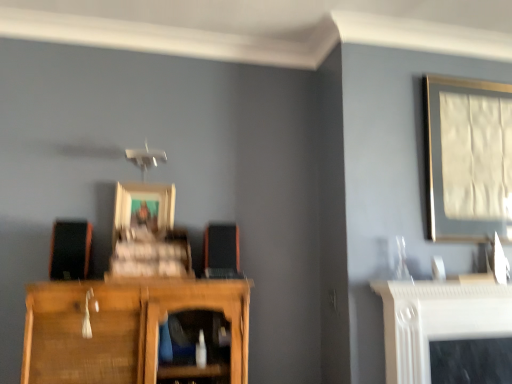
Question: Is matte black speaker at left, the second speaker in the right-to-left sequence, at the right side of wooden picture frame at center, which ranks as the 2th picture frame in right-to-left order?

Choices:
 (A) yes
 (B) no

Answer: (B)

Question: From a real-world perspective, is matte black speaker at left, the second speaker in the right-to-left sequence, physically below wooden picture frame at center, which ranks as the 2th picture frame in right-to-left order?

Choices:
 (A) no
 (B) yes

Answer: (B)

Question: From a real-world perspective, is matte black speaker at left, the second speaker in the right-to-left sequence, on wooden picture frame at center, placed as the first picture frame when sorted from left to right?

Choices:
 (A) yes
 (B) no

Answer: (B)

Question: Does matte black speaker at left, acting as the first speaker starting from the left, come in front of wooden picture frame at center, placed as the first picture frame when sorted from left to right?

Choices:
 (A) yes
 (B) no

Answer: (A)

Question: Is matte black speaker at left, the second speaker in the right-to-left sequence, facing away from wooden picture frame at center, which ranks as the 2th picture frame in right-to-left order?

Choices:
 (A) no
 (B) yes

Answer: (A)

Question: From the image's perspective, is matte silver picture frame at upper right, the second picture frame when ordered from left to right, above or below wooden picture frame at center, which ranks as the 2th picture frame in right-to-left order?

Choices:
 (A) above
 (B) below

Answer: (A)

Question: From a real-world perspective, relative to wooden picture frame at center, placed as the first picture frame when sorted from left to right, is matte silver picture frame at upper right, arranged as the 1th picture frame when viewed from the right, vertically above or below?

Choices:
 (A) below
 (B) above

Answer: (B)

Question: In the image, is matte silver picture frame at upper right, the second picture frame when ordered from left to right, positioned in front of or behind wooden picture frame at center, placed as the first picture frame when sorted from left to right?

Choices:
 (A) behind
 (B) front

Answer: (B)

Question: Based on their sizes in the image, would you say matte silver picture frame at upper right, the second picture frame when ordered from left to right, is bigger or smaller than wooden picture frame at center, placed as the first picture frame when sorted from left to right?

Choices:
 (A) small
 (B) big

Answer: (B)

Question: From a real-world perspective, is orange matte speaker at center, the 2th speaker in the left-to-right sequence, above or below matte black speaker at left, acting as the first speaker starting from the left?

Choices:
 (A) above
 (B) below

Answer: (A)

Question: Is orange matte speaker at center, which ranks as the first speaker in right-to-left order, in front of or behind matte black speaker at left, the second speaker in the right-to-left sequence, in the image?

Choices:
 (A) front
 (B) behind

Answer: (B)

Question: Is orange matte speaker at center, the 2th speaker in the left-to-right sequence, inside or outside of matte black speaker at left, the second speaker in the right-to-left sequence?

Choices:
 (A) inside
 (B) outside

Answer: (B)

Question: From the image's perspective, is orange matte speaker at center, the 2th speaker in the left-to-right sequence, above or below matte black speaker at left, acting as the first speaker starting from the left?

Choices:
 (A) below
 (B) above

Answer: (A)

Question: Is matte black speaker at left, acting as the first speaker starting from the left, situated inside matte silver picture frame at upper right, the second picture frame when ordered from left to right, or outside?

Choices:
 (A) inside
 (B) outside

Answer: (B)

Question: Considering the positions of matte black speaker at left, the second speaker in the right-to-left sequence, and matte silver picture frame at upper right, the second picture frame when ordered from left to right, in the image, is matte black speaker at left, the second speaker in the right-to-left sequence, taller or shorter than matte silver picture frame at upper right, the second picture frame when ordered from left to right,?

Choices:
 (A) tall
 (B) short

Answer: (B)